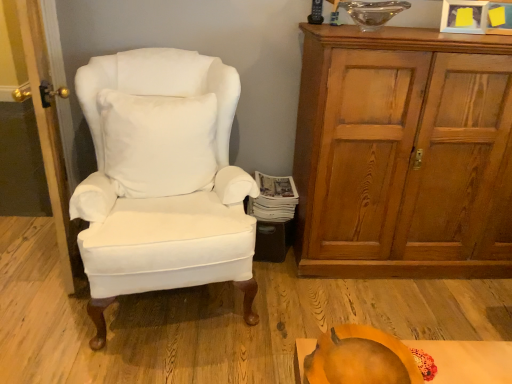
The height and width of the screenshot is (384, 512). What do you see at coordinates (162, 179) in the screenshot?
I see `white cotton wingback chair at left` at bounding box center [162, 179].

Identify the location of white soft pillow at center. pyautogui.click(x=158, y=143).

What do you see at coordinates (158, 143) in the screenshot? This screenshot has width=512, height=384. I see `white soft pillow at center` at bounding box center [158, 143].

Describe the element at coordinates (50, 137) in the screenshot. The image size is (512, 384). I see `wooden door at left` at that location.

Image resolution: width=512 pixels, height=384 pixels. In order to click on wooden cabinet at right in this screenshot , I will do `click(404, 154)`.

What do you see at coordinates (404, 154) in the screenshot? The width and height of the screenshot is (512, 384). I see `wooden cabinet at right` at bounding box center [404, 154].

Locate an element on the screen. white cotton wingback chair at left is located at coordinates (162, 179).

Is orange matte pumpkin at lower center closer to the viewer compared to wooden door at left?

That is True.

From a real-world perspective, which object stands above the other?

wooden door at left, from a real-world perspective.

Could wooden door at left be considered to be inside orange matte pumpkin at lower center?

No, wooden door at left is located outside of orange matte pumpkin at lower center.

Can you confirm if wooden door at left is bigger than white soft pillow at center?

Yes, wooden door at left is bigger than white soft pillow at center.

Does wooden door at left come in front of white soft pillow at center?

Yes, the depth of wooden door at left is less than that of white soft pillow at center.

Is white soft pillow at center completely or partially inside wooden door at left?

No, white soft pillow at center is not a part of wooden door at left.

From the image's perspective, between wooden door at left and white soft pillow at center, which one is located above?

wooden door at left, from the image's perspective.

Is white soft pillow at center looking in the opposite direction of wooden door at left?

No, wooden door at left is not at the back of white soft pillow at center.

From the image's perspective, would you say white soft pillow at center is positioned over wooden door at left?

Incorrect, from the image's perspective, white soft pillow at center is lower than wooden door at left.

Between white soft pillow at center and wooden door at left, which one has more height?

With more height is wooden door at left.

How many degrees apart are the facing directions of white soft pillow at center and wooden cabinet at right?

11.4 degrees.

From a real-world perspective, relative to wooden cabinet at right, is white soft pillow at center vertically above or below?

Clearly, from a real-world perspective, white soft pillow at center is above wooden cabinet at right.

Is white soft pillow at center directly adjacent to wooden cabinet at right?

white soft pillow at center and wooden cabinet at right are not in contact.

Does white soft pillow at center come in front of wooden cabinet at right?

Yes, white soft pillow at center is in front of wooden cabinet at right.

Is orange matte pumpkin at lower center to the left or to the right of wooden cabinet at right in the image?

Clearly, orange matte pumpkin at lower center is on the left of wooden cabinet at right in the image.

Is orange matte pumpkin at lower center facing away from wooden cabinet at right?

No, orange matte pumpkin at lower center's orientation is not away from wooden cabinet at right.

Considering the sizes of orange matte pumpkin at lower center and wooden cabinet at right in the image, is orange matte pumpkin at lower center taller or shorter than wooden cabinet at right?

In the image, orange matte pumpkin at lower center appears to be shorter than wooden cabinet at right.

From the image's perspective, would you say wooden cabinet at right is positioned over white soft pillow at center?

Incorrect, from the image's perspective, wooden cabinet at right is lower than white soft pillow at center.

How far apart are wooden cabinet at right and white soft pillow at center?

wooden cabinet at right and white soft pillow at center are 31.52 inches apart from each other.

Based on their sizes in the image, would you say wooden cabinet at right is bigger or smaller than white soft pillow at center?

wooden cabinet at right is bigger than white soft pillow at center.

Does wooden cabinet at right have a lesser height compared to white soft pillow at center?

No.

Is white cotton wingback chair at left next to orange matte pumpkin at lower center?

white cotton wingback chair at left is not next to orange matte pumpkin at lower center, and they're not touching.

Between white cotton wingback chair at left and orange matte pumpkin at lower center, which one appears on the right side from the viewer's perspective?

orange matte pumpkin at lower center is more to the right.

From the image's perspective, is white cotton wingback chair at left on orange matte pumpkin at lower center?

Indeed, from the image's perspective, white cotton wingback chair at left is shown above orange matte pumpkin at lower center.

From a real-world perspective, is white cotton wingback chair at left positioned under orange matte pumpkin at lower center based on gravity?

Actually, white cotton wingback chair at left is physically above orange matte pumpkin at lower center in the real world.

This screenshot has height=384, width=512. What are the coordinates of `pumpkin on the right of wooden door at left` in the screenshot? It's located at (360, 358).

Where is `pillow below the wooden door at left (from the image's perspective)`? The width and height of the screenshot is (512, 384). pillow below the wooden door at left (from the image's perspective) is located at coordinates (158, 143).

Based on their spatial positions, is white cotton wingback chair at left or white soft pillow at center closer to wooden cabinet at right?

Based on the image, white cotton wingback chair at left appears to be nearer to wooden cabinet at right.

Estimate the real-world distances between objects in this image. Which object is further from white soft pillow at center, orange matte pumpkin at lower center or wooden cabinet at right?

orange matte pumpkin at lower center lies further to white soft pillow at center than the other object.

Based on the photo, looking at the image, which one is located closer to orange matte pumpkin at lower center, wooden cabinet at right or wooden door at left?

→ wooden cabinet at right is closer to orange matte pumpkin at lower center.

Considering their positions, is white soft pillow at center positioned further to orange matte pumpkin at lower center than wooden door at left?

wooden door at left.

Considering their positions, is wooden door at left positioned closer to white cotton wingback chair at left than orange matte pumpkin at lower center?

Based on the image, wooden door at left appears to be nearer to white cotton wingback chair at left.

Considering their positions, is orange matte pumpkin at lower center positioned further to white cotton wingback chair at left than white soft pillow at center?

orange matte pumpkin at lower center.

Which object lies nearer to the anchor point wooden cabinet at right, orange matte pumpkin at lower center or white cotton wingback chair at left?

white cotton wingback chair at left is positioned closer to the anchor wooden cabinet at right.

When comparing their distances from wooden cabinet at right, does white soft pillow at center or white cotton wingback chair at left seem closer?

The object closer to wooden cabinet at right is white cotton wingback chair at left.

The image size is (512, 384). Find the location of `chair between wooden door at left and orange matte pumpkin at lower center from left to right`. chair between wooden door at left and orange matte pumpkin at lower center from left to right is located at coordinates (162, 179).

You are a GUI agent. You are given a task and a screenshot of the screen. Output one action in this format:
    pyautogui.click(x=<x>, y=<y>)
    Task: Click on the pumpkin situated between white cotton wingback chair at left and wooden cabinet at right from left to right
    The image size is (512, 384).
    Given the screenshot: What is the action you would take?
    pyautogui.click(x=360, y=358)

Where is `chair situated between white soft pillow at center and wooden cabinet at right from left to right`? The height and width of the screenshot is (384, 512). chair situated between white soft pillow at center and wooden cabinet at right from left to right is located at coordinates (162, 179).

Identify the location of pumpkin situated between wooden door at left and wooden cabinet at right from left to right. (360, 358).